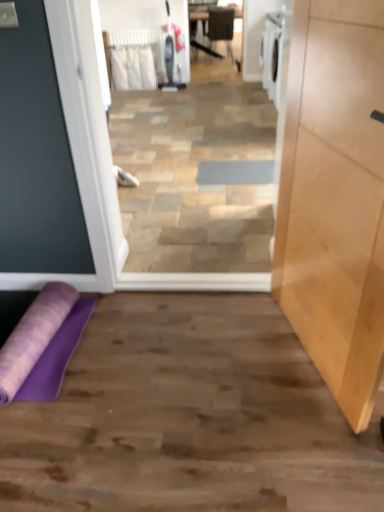
Where is `free space in front of light wood cabinet at right`? This screenshot has height=512, width=384. free space in front of light wood cabinet at right is located at coordinates (286, 443).